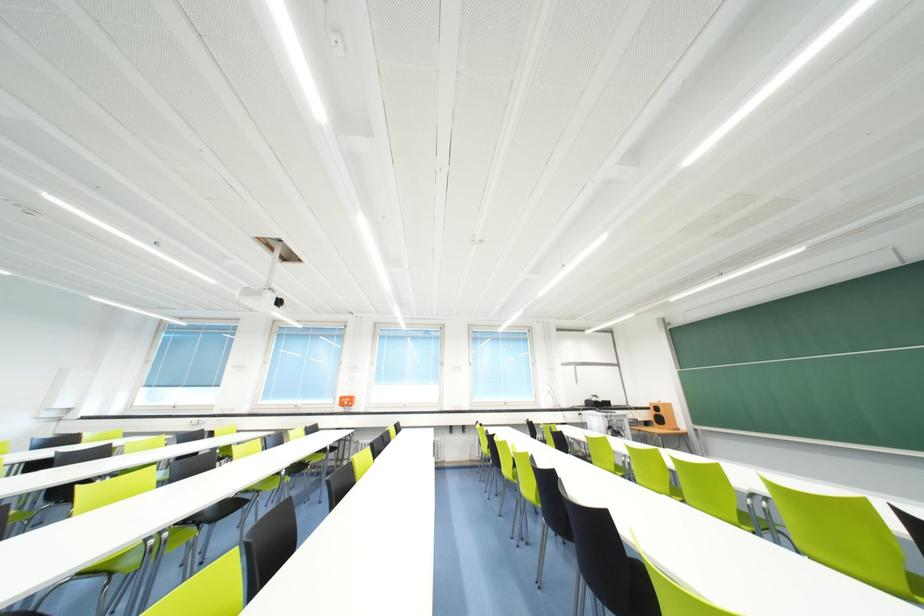
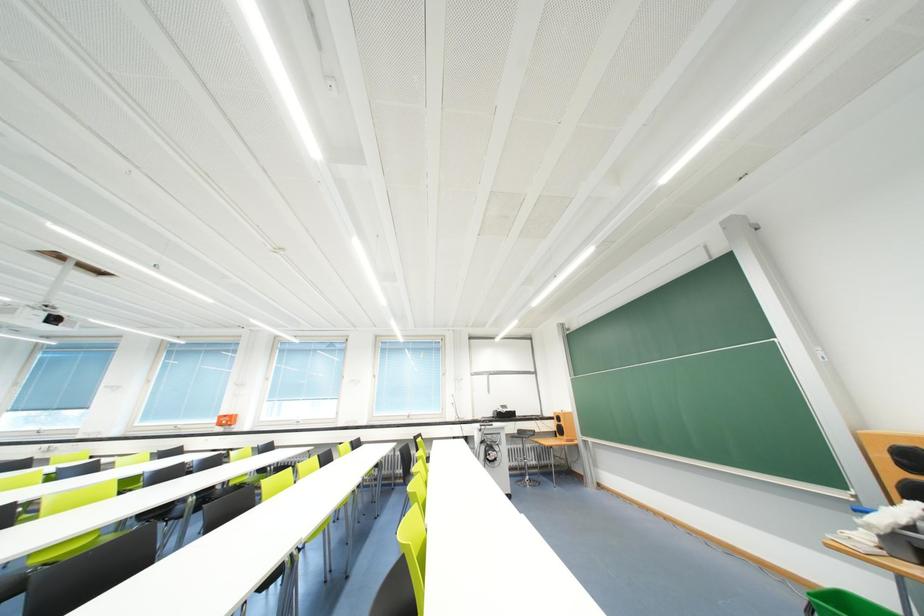
Question: In a continuous first-person perspective shot, in which direction is the camera moving?

Choices:
 (A) Left
 (B) Right
 (C) Forward
 (D) Backward

Answer: (B)